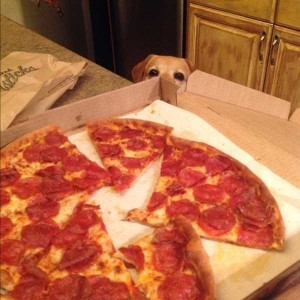
Where is `cabinet door`? cabinet door is located at coordinates (212, 32).